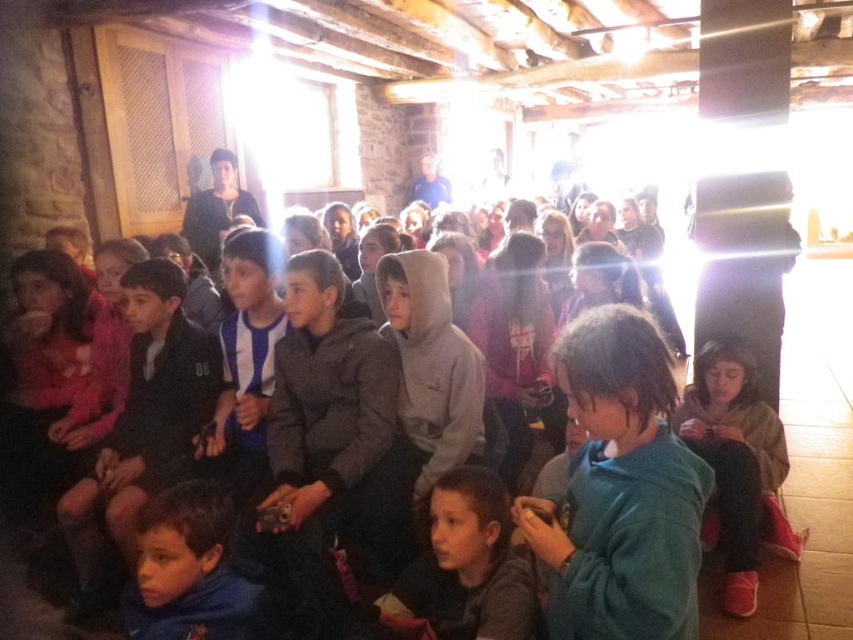
Is green fleece jacket at center thinner than gray hoodie at center?

Correct, green fleece jacket at center's width is less than gray hoodie at center's.

Does green fleece jacket at center appear on the left side of gray hoodie at center?

No, green fleece jacket at center is not to the left of gray hoodie at center.

At what (x,y) coordinates should I click in order to perform the action: click on green fleece jacket at center. Please return your answer as a coordinate pair (x, y). Image resolution: width=853 pixels, height=640 pixels. Looking at the image, I should click on [x=619, y=490].

Find the location of a particular element. green fleece jacket at center is located at coordinates (619, 490).

Measure the distance between point (756,384) and camera.

Point (756,384) is 2.93 meters from camera.

Does brown fuzzy jacket at lower right have a smaller size compared to gray hoodie at center?

Incorrect, brown fuzzy jacket at lower right is not smaller in size than gray hoodie at center.

Does point (752, 490) come behind point (480, 616)?

Yes, point (752, 490) is behind point (480, 616).

The height and width of the screenshot is (640, 853). I want to click on brown fuzzy jacket at lower right, so coord(735,467).

Can you confirm if green fleece jacket at center is wider than brown fuzzy jacket at lower right?

No, green fleece jacket at center is not wider than brown fuzzy jacket at lower right.

Between green fleece jacket at center and brown fuzzy jacket at lower right, which one appears on the right side from the viewer's perspective?

Positioned to the right is brown fuzzy jacket at lower right.

Locate an element on the screen. Image resolution: width=853 pixels, height=640 pixels. green fleece jacket at center is located at coordinates coord(619,490).

Find the location of a particular element. green fleece jacket at center is located at coordinates (619, 490).